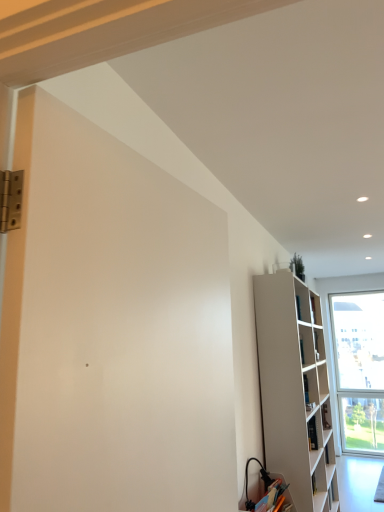
The width and height of the screenshot is (384, 512). I want to click on matte white cabinet at lower right, so click(277, 477).

Identify the location of white matte screen door at left. (112, 329).

Locate an element on the screen. matte white cabinet at lower right is located at coordinates (277, 477).

Considering the relative sizes of matte white cabinet at lower right and white matte bookshelf at right in the image provided, is matte white cabinet at lower right wider than white matte bookshelf at right?

No.

In the scene shown: Is matte white cabinet at lower right facing away from white matte bookshelf at right?

No, matte white cabinet at lower right's orientation is not away from white matte bookshelf at right.

Does matte white cabinet at lower right appear on the right side of white matte bookshelf at right?

Incorrect, matte white cabinet at lower right is not on the right side of white matte bookshelf at right.

From the image's perspective, which one is positioned lower, matte white cabinet at lower right or white matte bookshelf at right?

matte white cabinet at lower right, from the image's perspective.

The height and width of the screenshot is (512, 384). I want to click on screen door in front of the white matte bookshelf at right, so click(112, 329).

Considering the points (210, 214) and (296, 281), which point is in front, point (210, 214) or point (296, 281)?

The point (210, 214) is more forward.

Measure the distance between white matte screen door at left and white matte bookshelf at right.

A distance of 7.08 feet exists between white matte screen door at left and white matte bookshelf at right.

From a real-world perspective, between white matte screen door at left and white matte bookshelf at right, who is vertically lower?

white matte bookshelf at right, from a real-world perspective.

Considering the relative sizes of white matte screen door at left and matte white cabinet at lower right in the image provided, is white matte screen door at left wider than matte white cabinet at lower right?

Incorrect, the width of white matte screen door at left does not surpass that of matte white cabinet at lower right.

Considering the sizes of objects white matte screen door at left and matte white cabinet at lower right in the image provided, who is shorter, white matte screen door at left or matte white cabinet at lower right?

matte white cabinet at lower right is shorter.

Which point is more forward, (13, 489) or (240, 504)?

The point (13, 489) is closer to the camera.

Does white matte screen door at left turn towards matte white cabinet at lower right?

No, white matte screen door at left is not facing towards matte white cabinet at lower right.

Is white matte bookshelf at right inside or outside of matte white cabinet at lower right?

white matte bookshelf at right is not enclosed by matte white cabinet at lower right.

Is white matte bookshelf at right to the left of matte white cabinet at lower right from the viewer's perspective?

No, white matte bookshelf at right is not to the left of matte white cabinet at lower right.

From the image's perspective, which is below, white matte bookshelf at right or matte white cabinet at lower right?

matte white cabinet at lower right, from the image's perspective.

Which object is thinner, white matte bookshelf at right or matte white cabinet at lower right?

With smaller width is matte white cabinet at lower right.

Is matte white cabinet at lower right far from white matte screen door at left?

matte white cabinet at lower right is positioned a significant distance from white matte screen door at left.

In the scene shown: Visually, is matte white cabinet at lower right positioned to the left or to the right of white matte screen door at left?

In the image, matte white cabinet at lower right appears on the right side of white matte screen door at left.

Consider the image. How different are the orientations of matte white cabinet at lower right and white matte screen door at left in degrees?

The facing directions of matte white cabinet at lower right and white matte screen door at left are 5.05 degrees apart.

Can we say white matte bookshelf at right lies outside white matte screen door at left?

Yes, white matte bookshelf at right is located beyond the bounds of white matte screen door at left.

Considering the sizes of white matte bookshelf at right and white matte screen door at left in the image, is white matte bookshelf at right taller or shorter than white matte screen door at left?

In the image, white matte bookshelf at right appears to be taller than white matte screen door at left.

Considering the relative sizes of white matte bookshelf at right and white matte screen door at left in the image provided, is white matte bookshelf at right wider than white matte screen door at left?

Indeed, white matte bookshelf at right has a greater width compared to white matte screen door at left.

This screenshot has width=384, height=512. I want to click on shelf on the right of matte white cabinet at lower right, so click(295, 390).

This screenshot has width=384, height=512. Identify the location of shelf located behind the white matte screen door at left. (295, 390).

Considering their positions, is white matte bookshelf at right positioned further to matte white cabinet at lower right than white matte screen door at left?

Based on the image, white matte screen door at left appears to be further to matte white cabinet at lower right.

Looking at the image, which one is located further to white matte screen door at left, matte white cabinet at lower right or white matte bookshelf at right?

Among the two, white matte bookshelf at right is located further to white matte screen door at left.

Which object lies further to the anchor point matte white cabinet at lower right, white matte screen door at left or white matte bookshelf at right?

white matte screen door at left is further to matte white cabinet at lower right.

When comparing their distances from white matte bookshelf at right, does matte white cabinet at lower right or white matte screen door at left seem closer?

The object closer to white matte bookshelf at right is matte white cabinet at lower right.

Based on their spatial positions, is white matte bookshelf at right or matte white cabinet at lower right closer to white matte screen door at left?

Among the two, matte white cabinet at lower right is located nearer to white matte screen door at left.

Which object lies further to the anchor point white matte bookshelf at right, white matte screen door at left or matte white cabinet at lower right?

Among the two, white matte screen door at left is located further to white matte bookshelf at right.

Where is `cabinetry between white matte screen door at left and white matte bookshelf at right along the z-axis`? The image size is (384, 512). cabinetry between white matte screen door at left and white matte bookshelf at right along the z-axis is located at coordinates (277, 477).